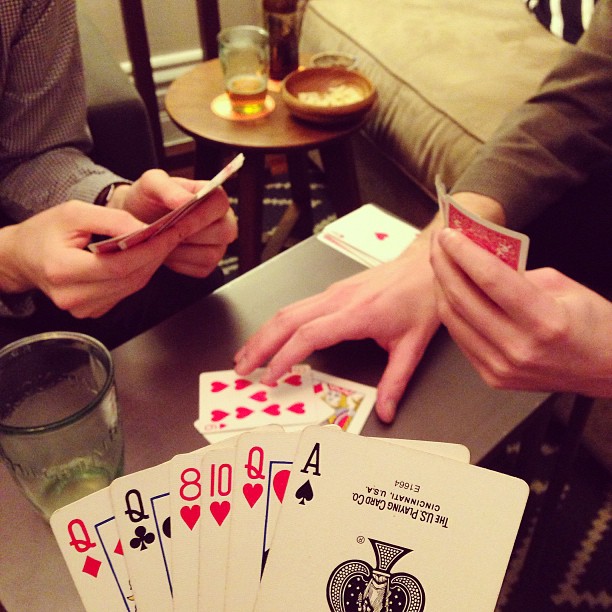
The height and width of the screenshot is (612, 612). Find the location of `couch`. couch is located at coordinates (468, 53).